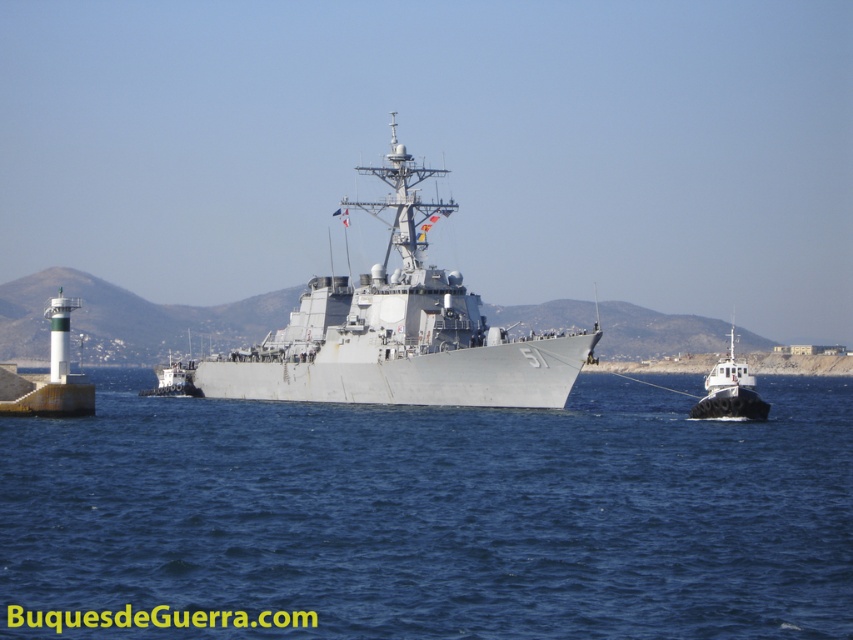
Does point (15, 436) come closer to viewer compared to point (479, 324)?

Yes, it is.

The width and height of the screenshot is (853, 640). In order to click on blue water at center in this screenshot , I will do `click(432, 516)`.

Can you confirm if blue water at center is taller than white matte tugboat at right?

In fact, blue water at center may be shorter than white matte tugboat at right.

Is point (737, 512) positioned after point (705, 404)?

No, it is in front of (705, 404).

Is point (311, 572) more distant than point (746, 403)?

No, it is in front of (746, 403).

I want to click on blue water at center, so click(x=432, y=516).

Who is taller, gray metallic warship at center or white matte tugboat at right?

With more height is gray metallic warship at center.

Is gray metallic warship at center above white matte tugboat at right?

Yes, gray metallic warship at center is above white matte tugboat at right.

Does point (210, 376) come behind point (729, 387)?

Yes, point (210, 376) is farther from viewer.

The image size is (853, 640). In order to click on gray metallic warship at center in this screenshot , I will do `click(398, 330)`.